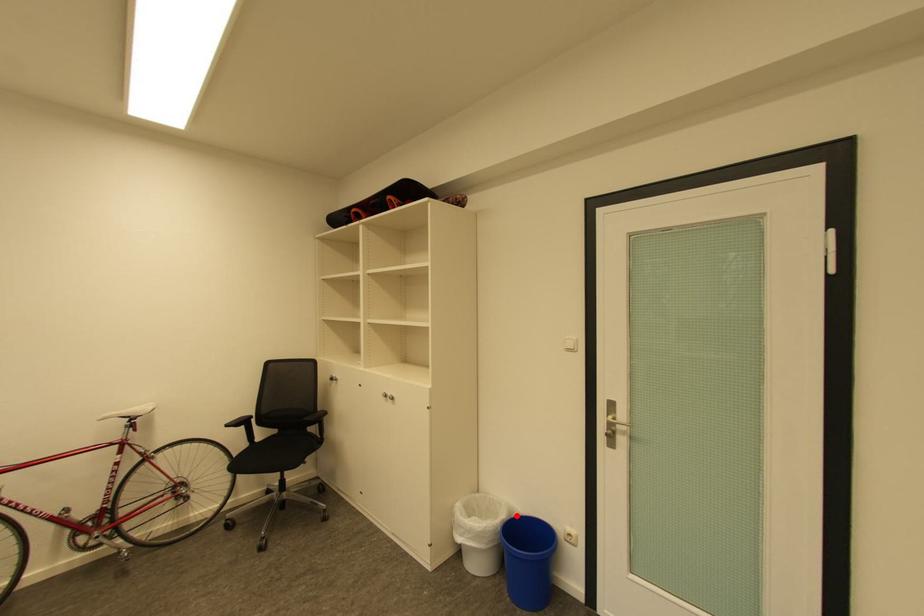
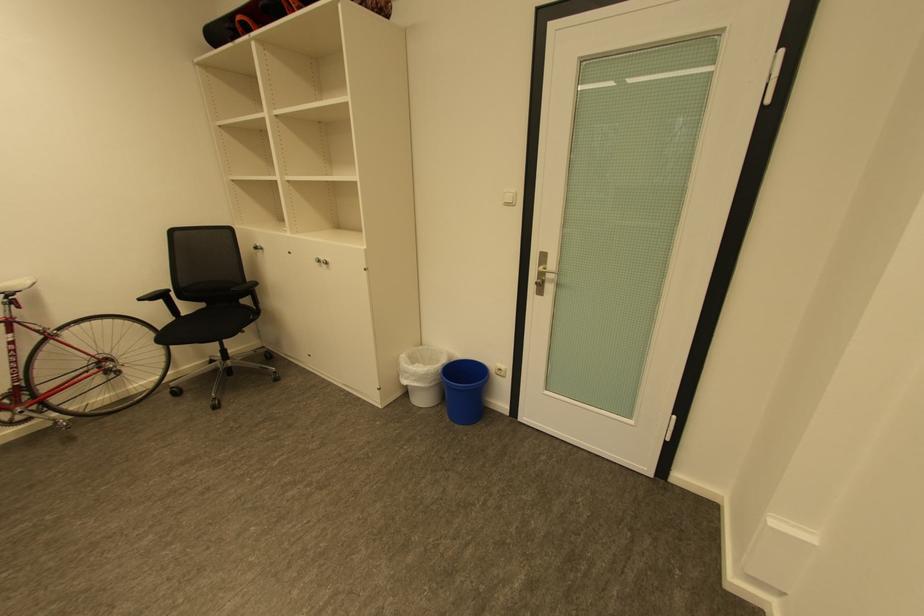
The point at the highlighted location is marked in the first image. Where is the corresponding point in the second image?

(456, 361)